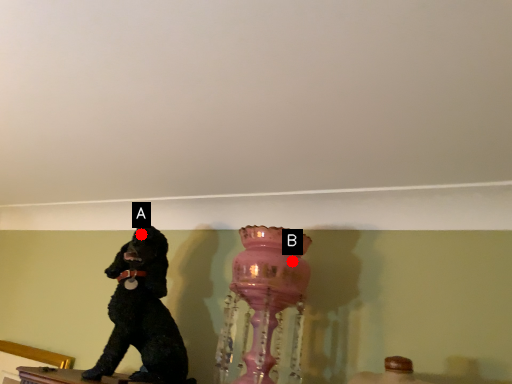
Question: Two points are circled on the image, labeled by A and B beside each circle. Which point appears closest to the camera in this image?

Choices:
 (A) A is closer
 (B) B is closer

Answer: (B)